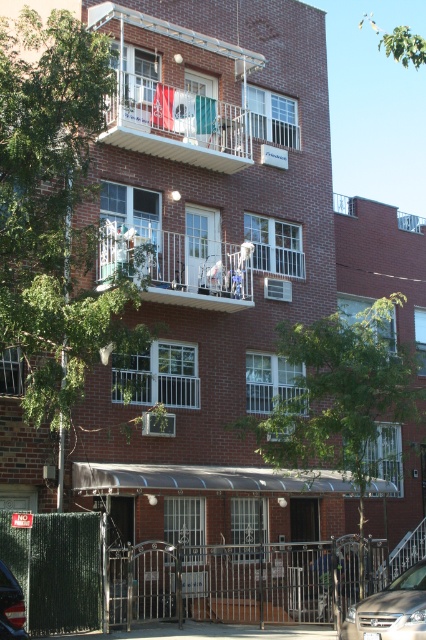
Question: Which of these objects is positioned farthest from the white plastic laundry at center?

Choices:
 (A) shiny blue car at lower left
 (B) white plastic balcony at upper center

Answer: (A)

Question: Considering the real-world distances, which object is closest to the shiny blue car at lower left?

Choices:
 (A) white plastic balcony at upper center
 (B) silver metallic sedan at center

Answer: (B)

Question: In this image, where is white plastic balcony at upper center located relative to silver metallic sedan at center?

Choices:
 (A) right
 (B) left

Answer: (B)

Question: Can you confirm if white plastic laundry at center is positioned above silver metallic sedan at center?

Choices:
 (A) no
 (B) yes

Answer: (B)

Question: Estimate the real-world distances between objects in this image. Which object is closer to the white plastic laundry at center?

Choices:
 (A) silver metallic sedan at center
 (B) shiny blue car at lower left
 (C) white plastic balcony at upper center

Answer: (C)

Question: Can you confirm if white plastic balcony at upper center is wider than silver metallic sedan at center?

Choices:
 (A) no
 (B) yes

Answer: (B)